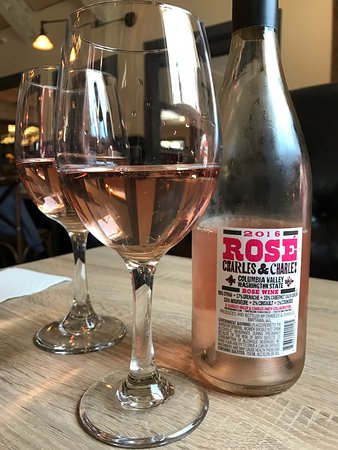
You are a GUI agent. You are given a task and a screenshot of the screen. Output one action in this format:
    pyautogui.click(x=<x>, y=<y>)
    Task: Click on the door way
    The height and width of the screenshot is (450, 338).
    Given the screenshot: What is the action you would take?
    pyautogui.click(x=217, y=65)